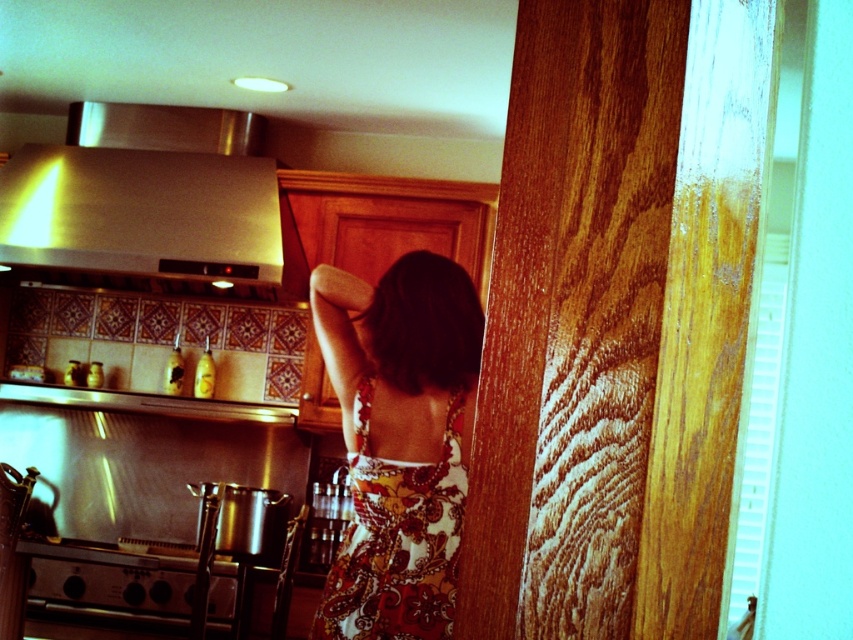
Locate an element on the screen. stainless steel exhaust hood at upper left is located at coordinates (146, 195).

How much distance is there between stainless steel exhaust hood at upper left and floral print fabric dress at center?

stainless steel exhaust hood at upper left is 6.48 feet away from floral print fabric dress at center.

Is point (151, 257) farther from camera compared to point (383, 516)?

Yes, it is.

The width and height of the screenshot is (853, 640). In order to click on stainless steel exhaust hood at upper left in this screenshot , I will do `click(146, 195)`.

Which is more to the left, stainless steel exhaust hood at upper left or stainless steel oven at lower left?

Positioned to the left is stainless steel exhaust hood at upper left.

Which is in front, point (83, 204) or point (61, 604)?

Point (61, 604)

Image resolution: width=853 pixels, height=640 pixels. I want to click on stainless steel exhaust hood at upper left, so click(x=146, y=195).

Does floral print fabric dress at center have a greater height compared to stainless steel oven at lower left?

Yes, floral print fabric dress at center is taller than stainless steel oven at lower left.

Is the position of floral print fabric dress at center less distant than that of stainless steel oven at lower left?

Yes, it is.

Locate an element on the screen. The height and width of the screenshot is (640, 853). floral print fabric dress at center is located at coordinates 397,538.